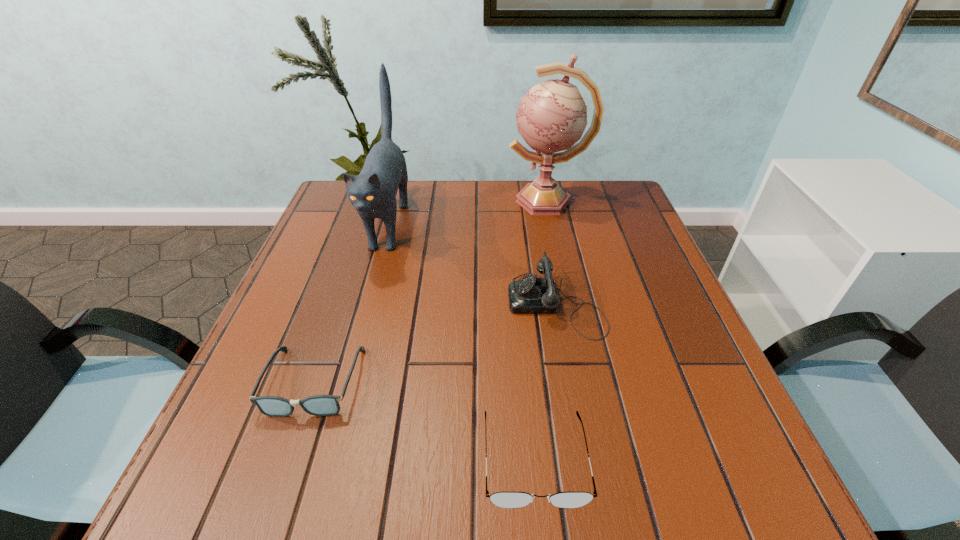
This screenshot has width=960, height=540. Find the location of `vacant position in the image that satisfies the following two spatial constraints: 1. on the front-facing side of the globe; 2. on the face of the left spectacles`. vacant position in the image that satisfies the following two spatial constraints: 1. on the front-facing side of the globe; 2. on the face of the left spectacles is located at coordinates (586, 382).

Find the location of a particular element. Image resolution: width=960 pixels, height=540 pixels. vacant position in the image that satisfies the following two spatial constraints: 1. on the front-facing side of the globe; 2. at the face of the cat is located at coordinates (552, 224).

Identify the location of vacant area that satisfies the following two spatial constraints: 1. on the front-facing side of the globe; 2. on the lenses of the right spectacles. (603, 459).